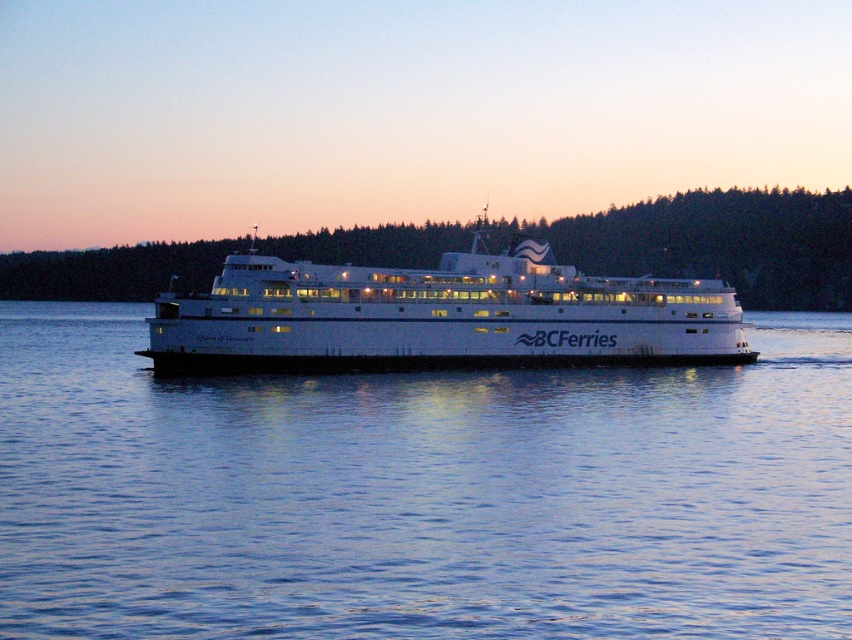
Question: Which object is closer to the camera taking this photo?

Choices:
 (A) blue water at center
 (B) white smooth ferry at center

Answer: (A)

Question: Where is blue water at center located in relation to white smooth ferry at center in the image?

Choices:
 (A) above
 (B) below

Answer: (B)

Question: In this image, where is blue water at center located relative to white smooth ferry at center?

Choices:
 (A) left
 (B) right

Answer: (A)

Question: Which point is farther to the camera?

Choices:
 (A) blue water at center
 (B) white smooth ferry at center

Answer: (B)

Question: Does blue water at center appear over white smooth ferry at center?

Choices:
 (A) no
 (B) yes

Answer: (A)

Question: Which of the following is the closest to the observer?

Choices:
 (A) (660, 300)
 (B) (335, 580)

Answer: (B)